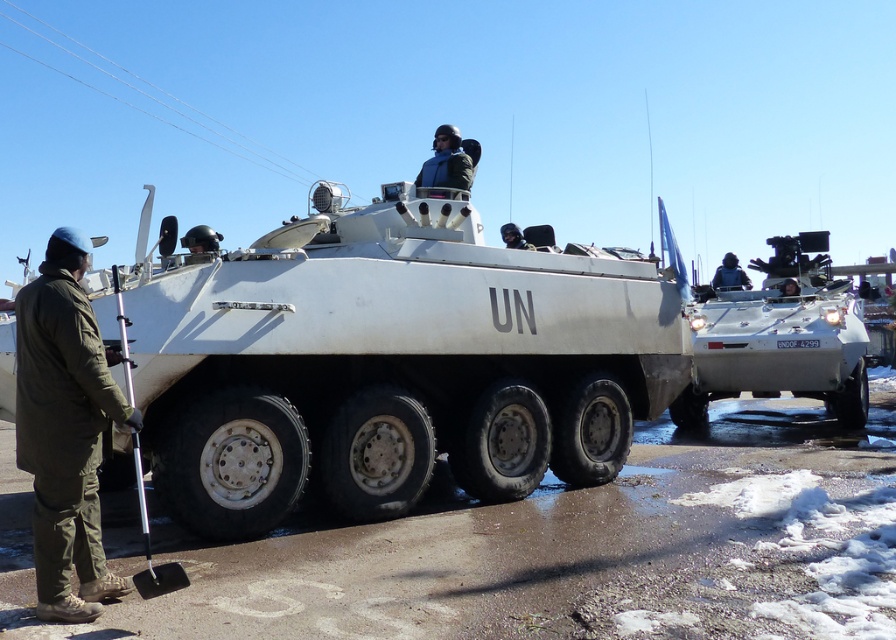
Question: Observing the image, what is the correct spatial positioning of green matte uniform at left in reference to metallic helmet at upper center?

Choices:
 (A) left
 (B) right

Answer: (A)

Question: Which of the following is the closest to the observer?

Choices:
 (A) dark blue uniform at center
 (B) green matte uniform at left

Answer: (B)

Question: Which of these objects is positioned closest to the dark blue uniform at center?

Choices:
 (A) green matte uniform at left
 (B) silver metallic armored vehicle at center

Answer: (A)

Question: Is white matte armored vehicle at center wider than green matte uniform at left?

Choices:
 (A) yes
 (B) no

Answer: (A)

Question: Which point appears closest to the camera in this image?

Choices:
 (A) (97, 432)
 (B) (731, 269)

Answer: (A)

Question: Does white matte armored vehicle at center have a greater width compared to green matte uniform at left?

Choices:
 (A) yes
 (B) no

Answer: (A)